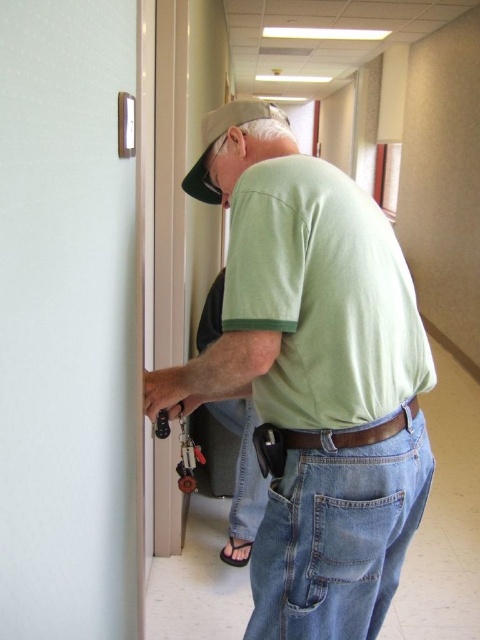
Based on the scene description, can you determine the spatial relationship between the green cotton shirt at center and the denim jeans at lower right?

The green cotton shirt at center is located above denim jeans at lower right.

You are standing in the hallway and want to reach the point at (x=361, y=483). If you can move 2 feet per second, how many seconds will it take you to reach that point?

The distance to the point at (x=361, y=483) is 3.51 feet. At a speed of 2 feet per second, it will take approximately 1.75 seconds to reach that point.

You are a delivery person holding a large package that is 14 inches wide. You need to pass through the hallway shown in the image. Can you fit through the space between the white glossy door at left and the green cotton shirt at center without squeezing?

The white glossy door at left is 13.87 inches away from the green cotton shirt at center, which is slightly narrower than the 14 inch wide package. Therefore, the package will not fit through the space between the white glossy door at left and the green cotton shirt at center without squeezing.